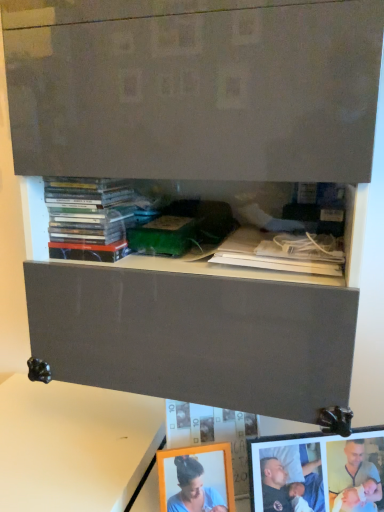
Question: Does white matte table at lower left have a larger size compared to matte wooden picture frame at lower right?

Choices:
 (A) yes
 (B) no

Answer: (A)

Question: Does white matte table at lower left come in front of matte wooden picture frame at lower right?

Choices:
 (A) yes
 (B) no

Answer: (B)

Question: From the image's perspective, is white matte table at lower left below matte wooden picture frame at lower right?

Choices:
 (A) yes
 (B) no

Answer: (A)

Question: Is white matte table at lower left positioned with its back to matte wooden picture frame at lower right?

Choices:
 (A) no
 (B) yes

Answer: (A)

Question: Is white matte table at lower left placed right next to matte wooden picture frame at lower right?

Choices:
 (A) no
 (B) yes

Answer: (A)

Question: Is white paper at upper center, the second book from the left, bigger or smaller than matte plastic books at upper left, the first book viewed from the left?

Choices:
 (A) small
 (B) big

Answer: (A)

Question: Would you say white paper at upper center, the second book from the left, is inside or outside matte plastic books at upper left, which is the second book in right-to-left order?

Choices:
 (A) outside
 (B) inside

Answer: (A)

Question: Is white paper at upper center, the second book from the left, taller or shorter than matte plastic books at upper left, the first book viewed from the left?

Choices:
 (A) tall
 (B) short

Answer: (B)

Question: In the image, is white paper at upper center, acting as the 1th book starting from the right, positioned in front of or behind matte plastic books at upper left, the first book viewed from the left?

Choices:
 (A) front
 (B) behind

Answer: (A)

Question: From a real-world perspective, is white paper at upper center, acting as the 1th book starting from the right, physically located above or below white matte table at lower left?

Choices:
 (A) above
 (B) below

Answer: (A)

Question: In the image, is white paper at upper center, acting as the 1th book starting from the right, positioned in front of or behind white matte table at lower left?

Choices:
 (A) behind
 (B) front

Answer: (B)

Question: Considering the positions of point (269, 247) and point (135, 422), is point (269, 247) closer or farther from the camera than point (135, 422)?

Choices:
 (A) farther
 (B) closer

Answer: (B)

Question: In terms of width, does white paper at upper center, acting as the 1th book starting from the right, look wider or thinner when compared to white matte table at lower left?

Choices:
 (A) wide
 (B) thin

Answer: (B)

Question: From a real-world perspective, is matte wooden picture frame at lower right physically located above or below white matte table at lower left?

Choices:
 (A) above
 (B) below

Answer: (A)

Question: Do you think matte wooden picture frame at lower right is within white matte table at lower left, or outside of it?

Choices:
 (A) outside
 (B) inside

Answer: (A)